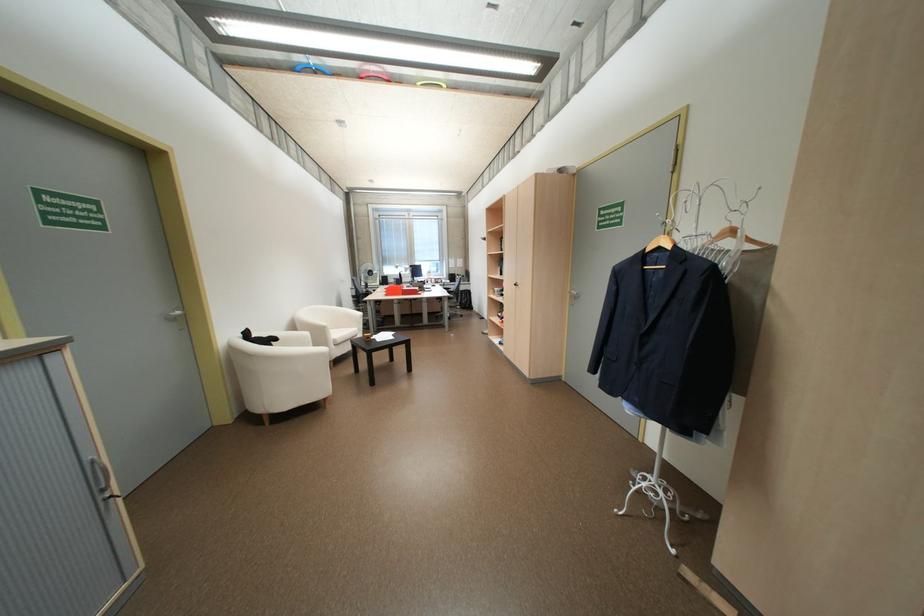
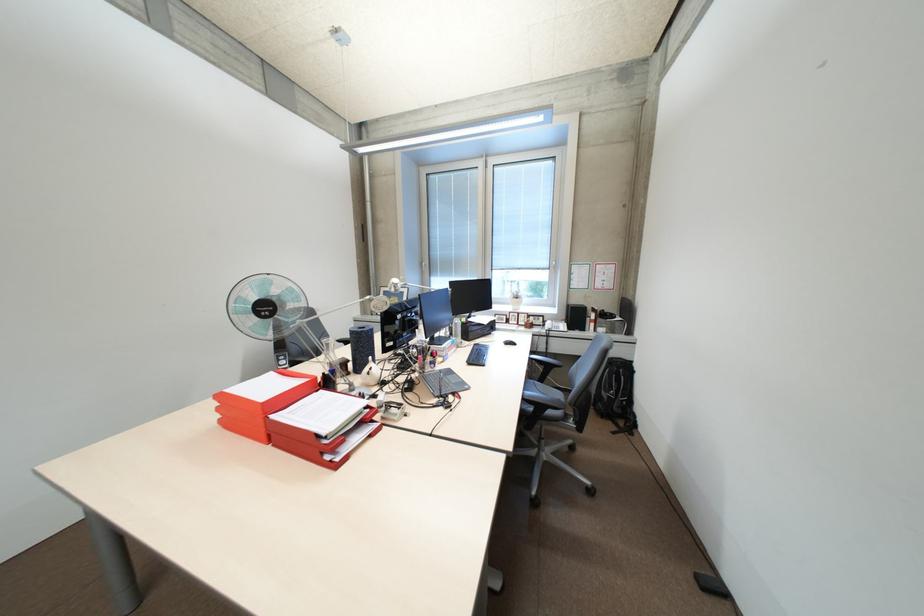
Locate, in the second image, the point that corresponds to point 396,294 in the first image.

(231, 421)